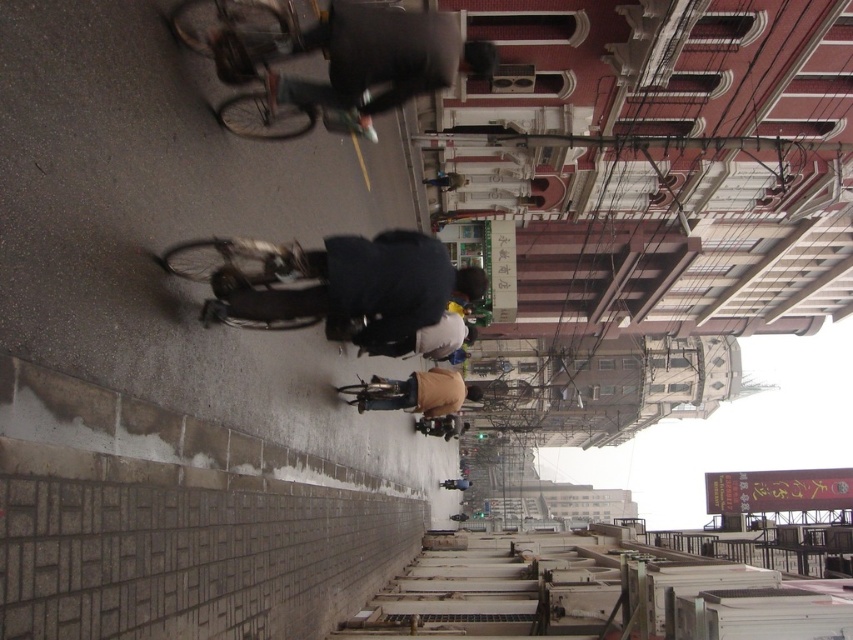
You are a pedestrian standing on the sidewalk and want to cross the street to reach the other side. There is a shiny metallic bicycle at center and a tan fabric pants at center in the road. Given that the bicycle is moving towards you, can you safely cross the street before the bicycle reaches you?

The shiny metallic bicycle at center is 57.36 feet away from tan fabric pants at center. Since the bicycle is moving towards you, you have enough time to cross the street safely before it reaches your position.

You are standing at point (229, 289) and want to walk to the nearest building entrance. The distance between you and the entrance is 20.75 meters. Is this distance within a comfortable walking range for a typical adult?

The distance between you and the entrance is 20.75 meters, which is within a comfortable walking range for a typical adult as it is less than 30 meters.

You are a pedestrian on the sidewalk and see a person wearing a dark blue fabric jacket at center and tan fabric pants at center. Which piece of clothing is positioned more to the left?

The dark blue fabric jacket at center is positioned to the left of the tan fabric pants at center, so the jacket is more to the left.